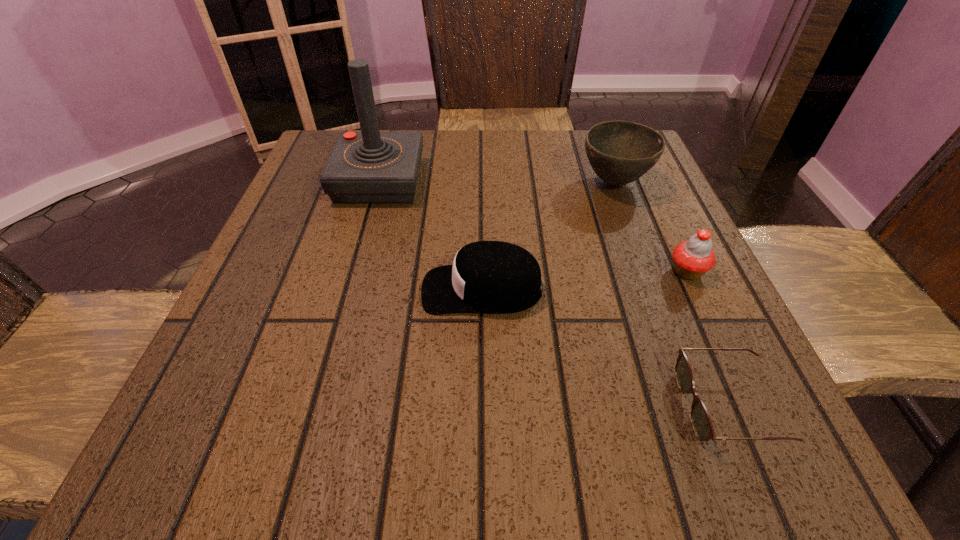
Identify the location of vacant space that's between the second tallest object and the nearest object. The width and height of the screenshot is (960, 540). (671, 294).

Where is `free area in between the leftmost object and the cap`? free area in between the leftmost object and the cap is located at coordinates (431, 235).

Locate an element on the screen. The image size is (960, 540). object that can be found as the second closest to the cupcake is located at coordinates (620, 152).

You are a GUI agent. You are given a task and a screenshot of the screen. Output one action in this format:
    pyautogui.click(x=<x>, y=<y>)
    Task: Click on the object that is the second closest to the spectacles
    
    Given the screenshot: What is the action you would take?
    pyautogui.click(x=486, y=276)

This screenshot has height=540, width=960. In order to click on free location that satisfies the following two spatial constraints: 1. on the front side of the cupcake; 2. on the front-facing side of the fourth object from right to left in this screenshot , I will do `click(695, 289)`.

The width and height of the screenshot is (960, 540). In order to click on vacant position in the image that satisfies the following two spatial constraints: 1. on the rectangular base of the fourth shortest object; 2. on the right side of the tallest object in this screenshot , I will do `click(379, 183)`.

Find the location of a particular element. This screenshot has width=960, height=540. vacant area in the image that satisfies the following two spatial constraints: 1. on the front side of the cupcake; 2. on the front-facing side of the fourth object from right to left is located at coordinates (x=695, y=289).